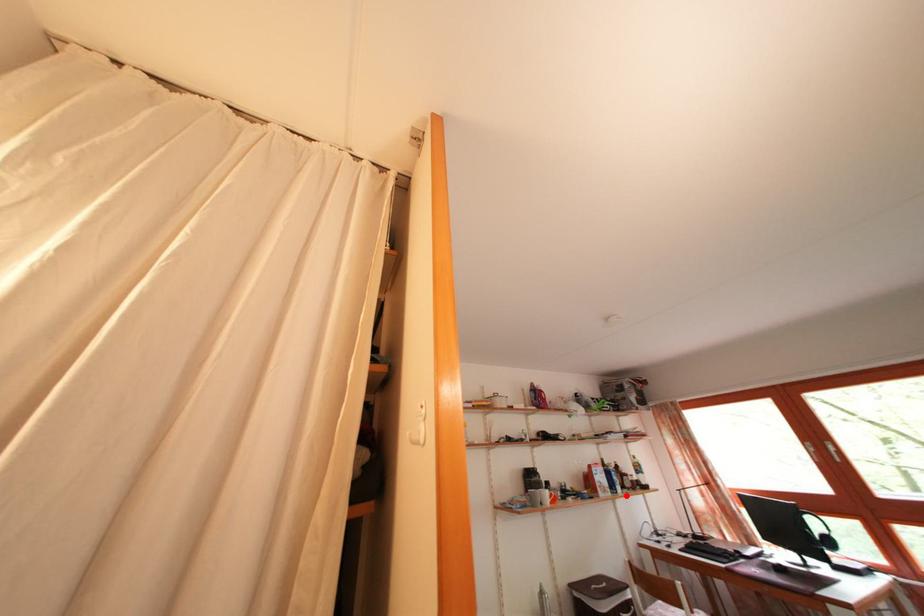
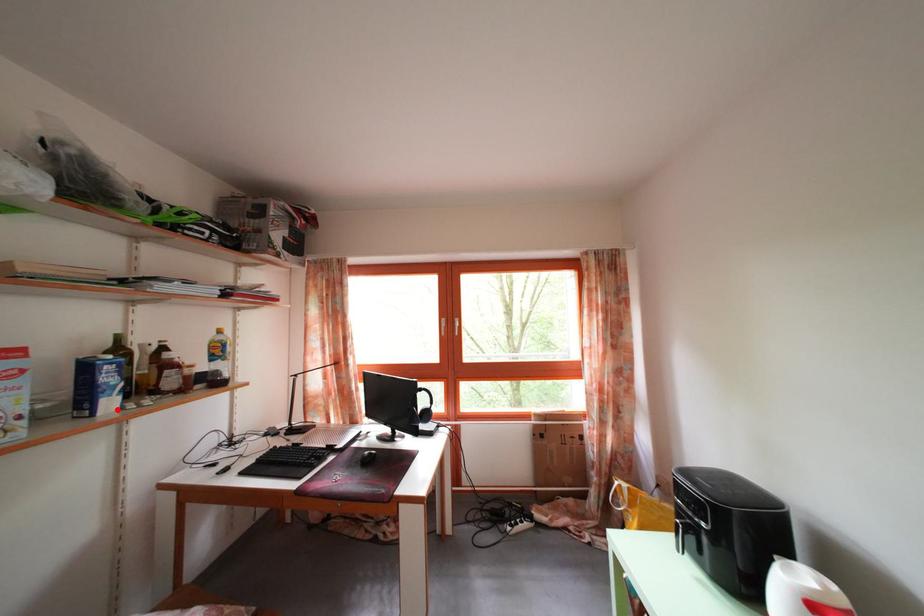
I am providing you with two images of the same scene from different viewpoints. A red point is marked on the first image and another point is marked on the second image. Is the marked point in image1 the same physical position as the marked point in image2?

Yes